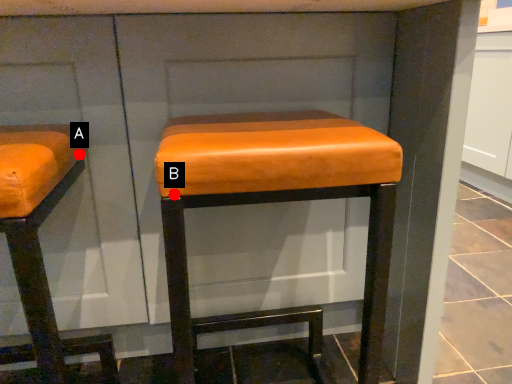
Question: Two points are circled on the image, labeled by A and B beside each circle. Which point is farther to the camera?

Choices:
 (A) A is further
 (B) B is further

Answer: (A)